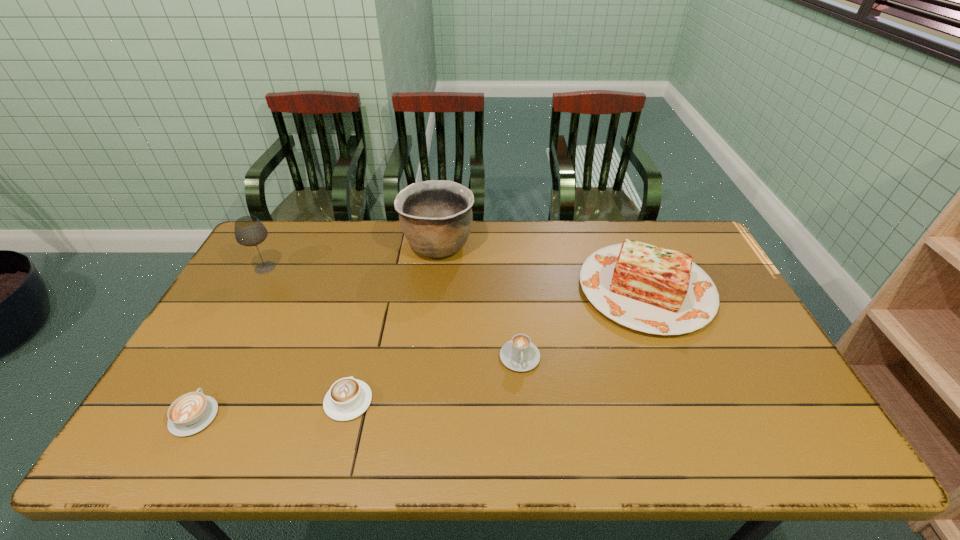
Locate an element on the screen. This screenshot has height=540, width=960. pottery is located at coordinates (436, 217).

This screenshot has width=960, height=540. I want to click on wineglass, so click(249, 231).

The height and width of the screenshot is (540, 960). I want to click on the third tallest object, so click(647, 288).

Image resolution: width=960 pixels, height=540 pixels. Find the location of `the rightmost object`. the rightmost object is located at coordinates (647, 288).

Where is `the farthest cappuccino`? The image size is (960, 540). the farthest cappuccino is located at coordinates (519, 354).

You are a GUI agent. You are given a task and a screenshot of the screen. Output one action in this format:
    pyautogui.click(x=<x>, y=<y>)
    Task: Click on the tallest cappuccino
    
    Given the screenshot: What is the action you would take?
    pyautogui.click(x=519, y=354)

The width and height of the screenshot is (960, 540). In order to click on the second shortest cappuccino in this screenshot , I will do `click(348, 398)`.

The image size is (960, 540). I want to click on the fifth tallest object, so click(x=348, y=398).

In order to click on the shortest cappuccino in this screenshot , I will do `click(190, 413)`.

This screenshot has width=960, height=540. What are the coordinates of `the shortest object` in the screenshot? It's located at coord(190,413).